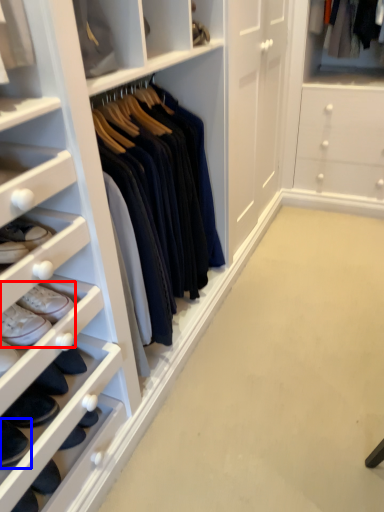
Question: Which object is further to the camera taking this photo, footwear (highlighted by a red box) or footwear (highlighted by a blue box)?

Choices:
 (A) footwear
 (B) footwear

Answer: (A)